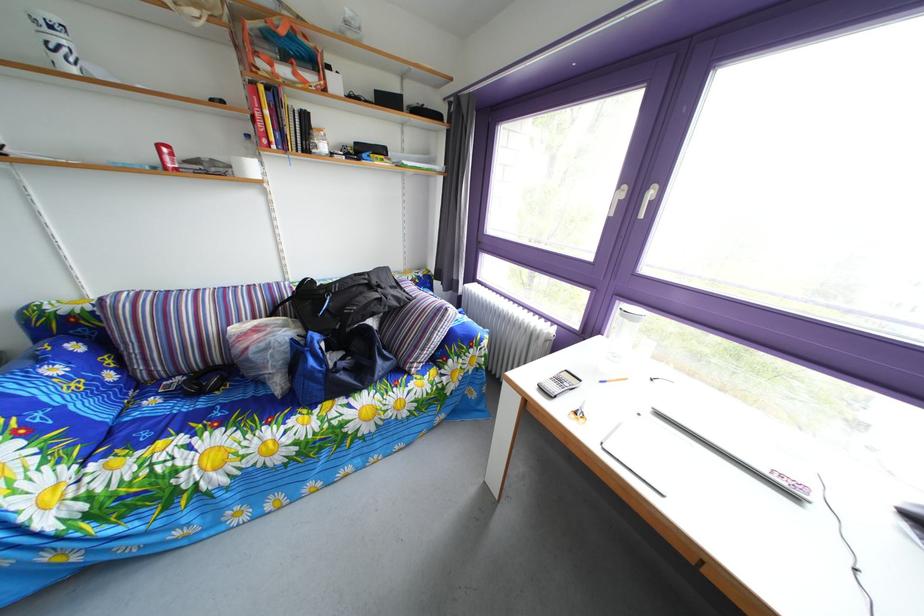
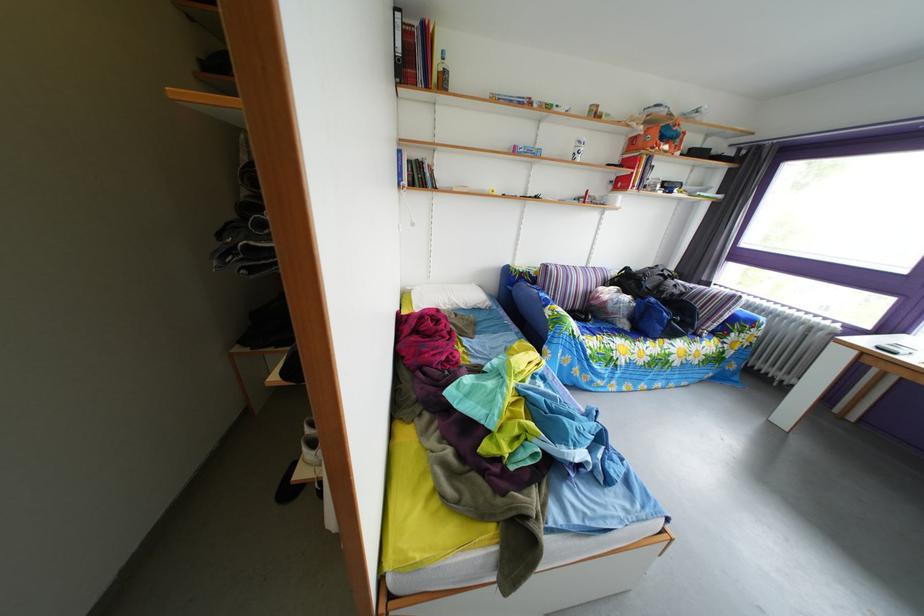
Locate, in the second image, the point that corresponds to point (319, 310) in the first image.

(638, 289)